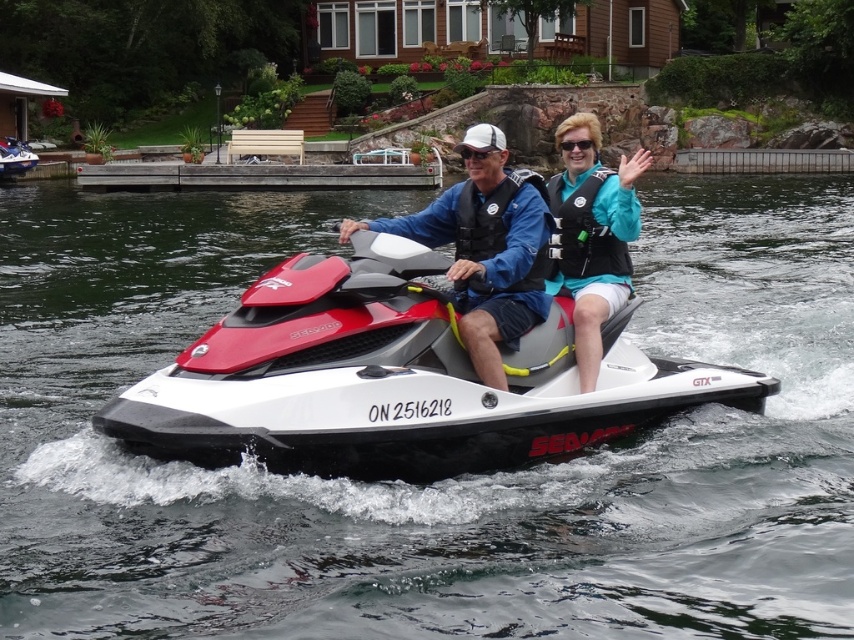
You are navigating a Sea Doo GTX PWC and need to locate the matte black life vest at center. Based on the coordinates provided in the Objects Description, can you determine its exact position relative to the PWC?

The matte black life vest at center is located at coordinates point (x=486, y=250), which places it centrally on the PWC.

You are a safety inspector assessing the distance between the matte black life vest at center and the camera position. According to regulations, the minimum safe distance for such equipment must be at least 60 feet. Is this setup compliant?

The distance between the matte black life vest at center and the camera is 59.86 feet, which is less than the required 60 feet. Therefore, the setup does not comply with safety regulations.

You are a safety inspector checking the distance between the two life vests on a Sea Doo GTX PWC. According to regulations, life vests must be at least 20 meters apart for quick access. Can both the matte black life vest at center and the teal fabric life vest at upper right meet this requirement?

The matte black life vest at center and the teal fabric life vest at upper right are 21.31 meters apart from each other, which exceeds the minimum requirement of 20 meters. Therefore, both life vests meet the regulation for quick access.